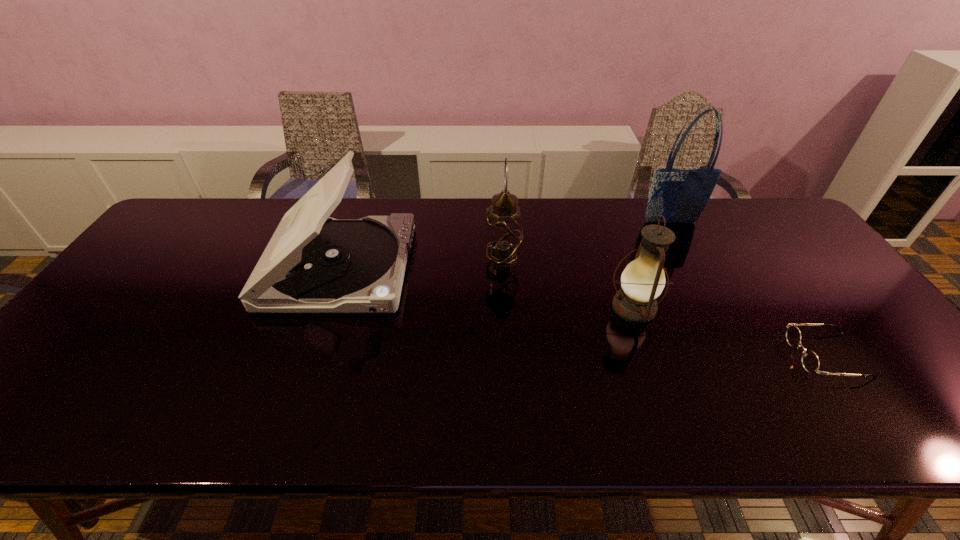
The width and height of the screenshot is (960, 540). What are the coordinates of `the farthest object` in the screenshot? It's located at (680, 196).

At what (x,y) coordinates should I click in order to perform the action: click on the fourth object from left to right. Please return your answer as a coordinate pair (x, y). The width and height of the screenshot is (960, 540). Looking at the image, I should click on (680, 196).

This screenshot has height=540, width=960. Find the location of `the farther oil lamp`. the farther oil lamp is located at coordinates (503, 235).

Where is `the second object from left to right`? the second object from left to right is located at coordinates (503, 235).

Identify the location of CD player. (313, 263).

Identify the location of the third object from right to left. (642, 281).

You are a GUI agent. You are given a task and a screenshot of the screen. Output one action in this format:
    pyautogui.click(x=<x>, y=<y>)
    Task: Click on the right oil lamp
    This screenshot has height=540, width=960.
    Given the screenshot: What is the action you would take?
    pyautogui.click(x=642, y=281)

Locate an element on the screen. spectacles is located at coordinates click(x=810, y=361).

Where is `the rightmost object`? The width and height of the screenshot is (960, 540). the rightmost object is located at coordinates (810, 361).

The width and height of the screenshot is (960, 540). In order to click on vacant point located on the front-facing side of the shopping bag in this screenshot , I will do [696, 270].